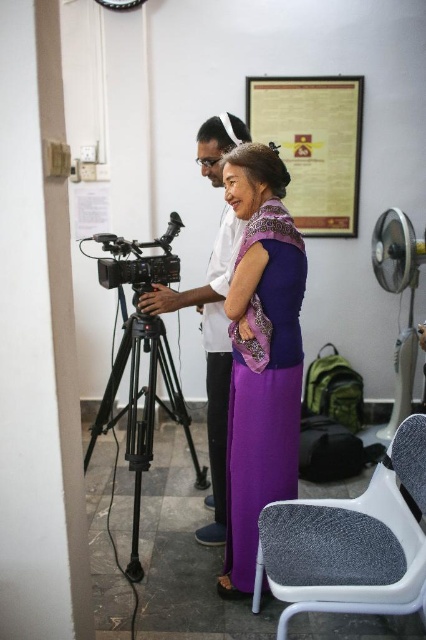
Does gray fabric chair at lower right have a smaller size compared to purple satin dress at center?

No.

Who is more distant from viewer, (279, 531) or (236, 451)?

The point (236, 451) is more distant.

You are a GUI agent. You are given a task and a screenshot of the screen. Output one action in this format:
    pyautogui.click(x=<x>, y=<y>)
    Task: Click on the gray fabric chair at lower right
    This screenshot has width=426, height=640.
    Given the screenshot: What is the action you would take?
    pyautogui.click(x=351, y=541)

Does purple satin dress at center appear on the right side of black plastic camera at center?

Yes, purple satin dress at center is to the right of black plastic camera at center.

Who is more distant from viewer, (275, 320) or (140, 257)?

The point (140, 257) is more distant.

Locate an element on the screen. This screenshot has width=426, height=640. purple satin dress at center is located at coordinates (264, 387).

Which is behind, point (311, 554) or point (301, 161)?

The point (301, 161) is behind.

Consider the image. Is gray fabric chair at lower right below gold metallic plaque at upper center?

Yes, gray fabric chair at lower right is below gold metallic plaque at upper center.

Which is behind, point (281, 634) or point (253, 109)?

Positioned behind is point (253, 109).

Locate an element on the screen. gray fabric chair at lower right is located at coordinates (351, 541).